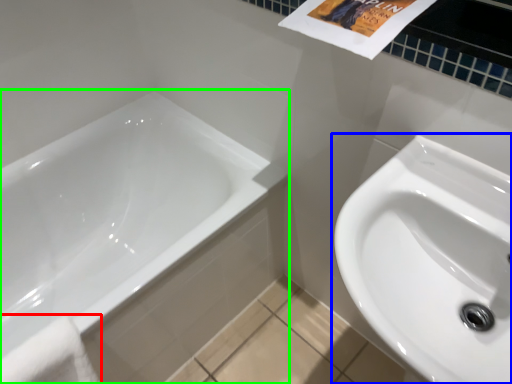
Question: Which object is positioned farthest from bath towel (highlighted by a red box)? Select from sink (highlighted by a blue box) and bathtub (highlighted by a green box).

Choices:
 (A) sink
 (B) bathtub

Answer: (A)